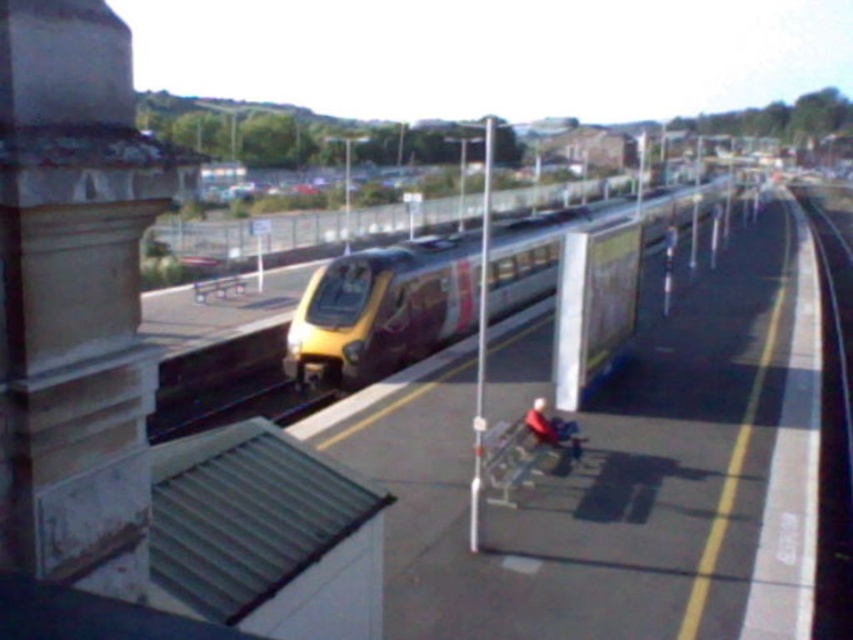
Question: Is stone column at left below yellow metallic train at center?

Choices:
 (A) yes
 (B) no

Answer: (A)

Question: Observing the image, what is the correct spatial positioning of yellow metallic train at center in reference to black metal train track at lower left?

Choices:
 (A) left
 (B) right

Answer: (B)

Question: Among these objects, which one is nearest to the camera?

Choices:
 (A) stone column at left
 (B) yellow metallic train at center

Answer: (A)

Question: Among these points, which one is farthest from the camera?

Choices:
 (A) (252, 390)
 (B) (409, 260)

Answer: (A)

Question: Among these points, which one is nearest to the camera?

Choices:
 (A) (9, 387)
 (B) (219, 392)
 (C) (531, 289)

Answer: (A)

Question: Does stone column at left have a greater width compared to yellow metallic train at center?

Choices:
 (A) no
 (B) yes

Answer: (A)